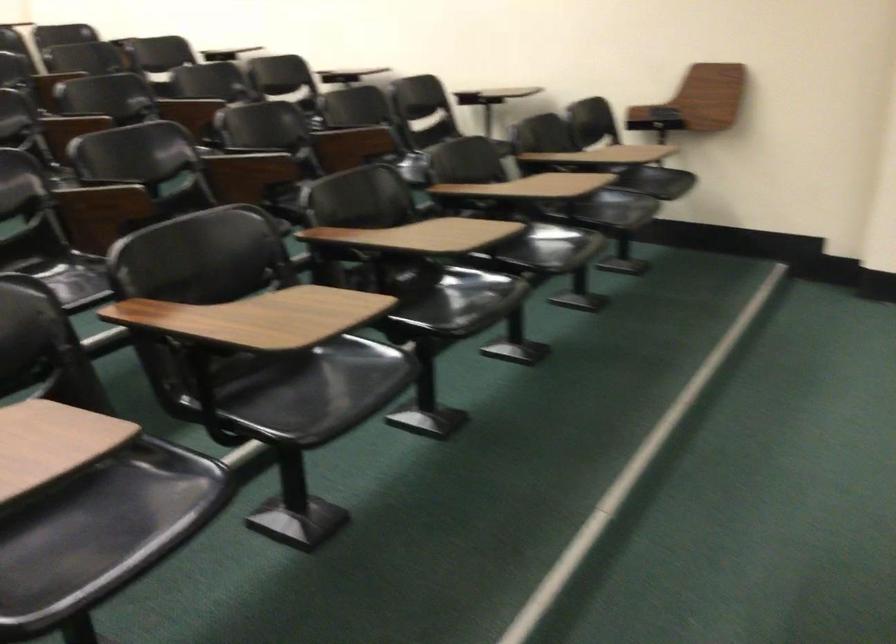
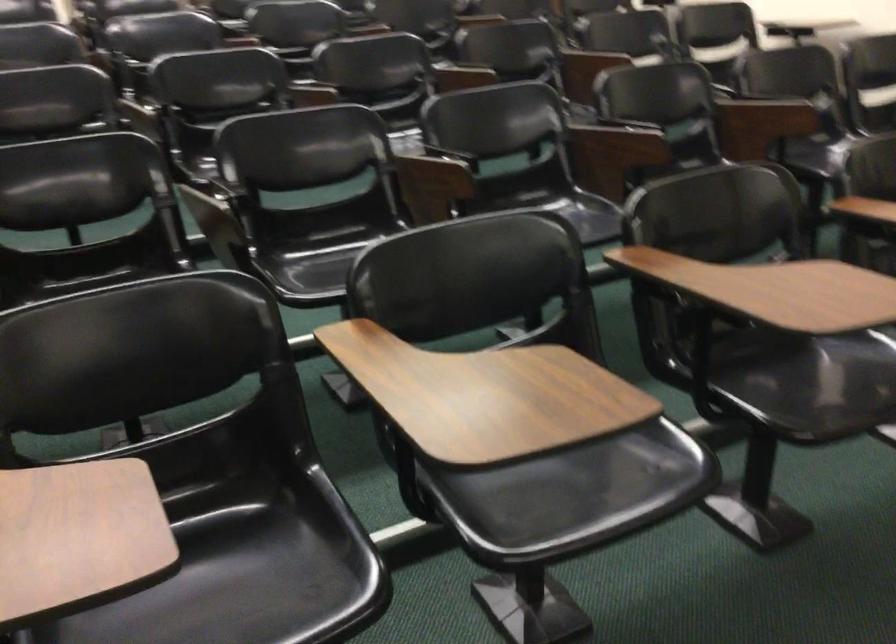
Question: Which direction would the cameraman need to move to produce the second image? Reply with the corresponding letter.

Choices:
 (A) Left
 (B) Right
 (C) Forward
 (D) Backward

Answer: (C)